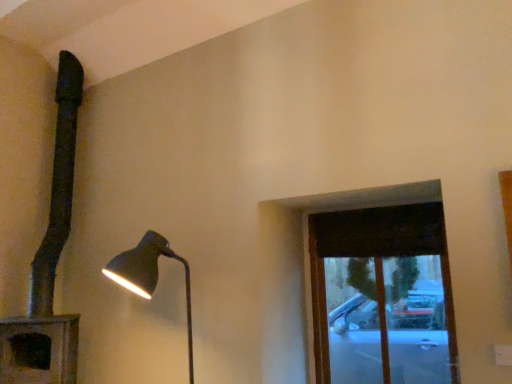
Question: Considering the relative positions of matte black lamp at left, the first lamp in the right-to-left sequence, and matte black lamp at left, which is counted as the 1th lamp, starting from the left, in the image provided, is matte black lamp at left, the first lamp in the right-to-left sequence, to the left of matte black lamp at left, which is counted as the 1th lamp, starting from the left, from the viewer's perspective?

Choices:
 (A) yes
 (B) no

Answer: (B)

Question: Is matte black lamp at left, marked as the 2th lamp in a left-to-right arrangement, further to the viewer compared to matte black lamp at left, which is counted as the 1th lamp, starting from the left?

Choices:
 (A) no
 (B) yes

Answer: (A)

Question: Does matte black lamp at left, the first lamp in the right-to-left sequence, have a lesser height compared to matte black lamp at left, which is counted as the 1th lamp, starting from the left?

Choices:
 (A) no
 (B) yes

Answer: (B)

Question: Is matte black lamp at left, marked as the 2th lamp in a left-to-right arrangement, closer to the viewer compared to matte black lamp at left, which is counted as the 1th lamp, starting from the left?

Choices:
 (A) no
 (B) yes

Answer: (B)

Question: Considering the relative sizes of matte black lamp at left, marked as the 2th lamp in a left-to-right arrangement, and matte black lamp at left, which is counted as the 1th lamp, starting from the left, in the image provided, is matte black lamp at left, marked as the 2th lamp in a left-to-right arrangement, taller than matte black lamp at left, which is counted as the 1th lamp, starting from the left,?

Choices:
 (A) yes
 (B) no

Answer: (B)

Question: Considering the relative sizes of matte black lamp at left, the first lamp in the right-to-left sequence, and matte black lamp at left, which is counted as the 2th lamp, starting from the right, in the image provided, is matte black lamp at left, the first lamp in the right-to-left sequence, bigger than matte black lamp at left, which is counted as the 2th lamp, starting from the right,?

Choices:
 (A) yes
 (B) no

Answer: (B)

Question: Does dark wood window at upper right have a greater height compared to matte black lamp at left, which is counted as the 2th lamp, starting from the right?

Choices:
 (A) no
 (B) yes

Answer: (A)

Question: Does dark wood window at upper right have a greater width compared to matte black lamp at left, which is counted as the 1th lamp, starting from the left?

Choices:
 (A) no
 (B) yes

Answer: (A)

Question: Considering the relative positions of dark wood window at upper right and matte black lamp at left, which is counted as the 1th lamp, starting from the left, in the image provided, is dark wood window at upper right to the left of matte black lamp at left, which is counted as the 1th lamp, starting from the left, from the viewer's perspective?

Choices:
 (A) no
 (B) yes

Answer: (A)

Question: Considering the relative positions of dark wood window at upper right and matte black lamp at left, which is counted as the 2th lamp, starting from the right, in the image provided, is dark wood window at upper right to the right of matte black lamp at left, which is counted as the 2th lamp, starting from the right, from the viewer's perspective?

Choices:
 (A) yes
 (B) no

Answer: (A)

Question: Can you confirm if dark wood window at upper right is bigger than matte black lamp at left, which is counted as the 2th lamp, starting from the right?

Choices:
 (A) no
 (B) yes

Answer: (A)

Question: Is dark wood window at upper right shorter than matte black lamp at left, which is counted as the 1th lamp, starting from the left?

Choices:
 (A) no
 (B) yes

Answer: (B)

Question: Can you confirm if matte black lamp at left, which is counted as the 2th lamp, starting from the right, is taller than matte black lamp at left, the first lamp in the right-to-left sequence?

Choices:
 (A) no
 (B) yes

Answer: (B)